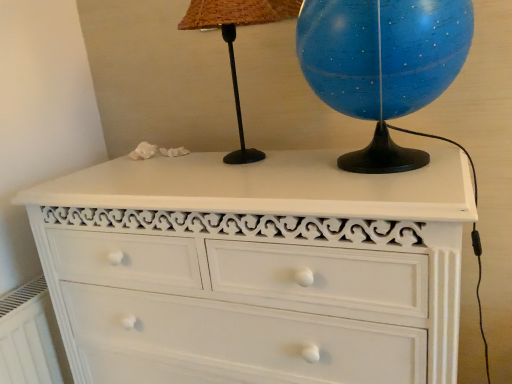
Question: Considering the positions of point (x=33, y=365) and point (x=241, y=127), is point (x=33, y=365) closer or farther from the camera than point (x=241, y=127)?

Choices:
 (A) closer
 (B) farther

Answer: (B)

Question: Is white painted radiator at lower left in front of or behind black matte table lamp at upper center in the image?

Choices:
 (A) behind
 (B) front

Answer: (A)

Question: Estimate the real-world distances between objects in this image. Which object is closer to the white painted wood chest of drawers at center?

Choices:
 (A) white painted radiator at lower left
 (B) black matte table lamp at upper center
 (C) blue glossy globe at upper right

Answer: (C)

Question: Which is farther from the white painted radiator at lower left?

Choices:
 (A) black matte table lamp at upper center
 (B) white painted wood chest of drawers at center
 (C) blue glossy globe at upper right

Answer: (C)